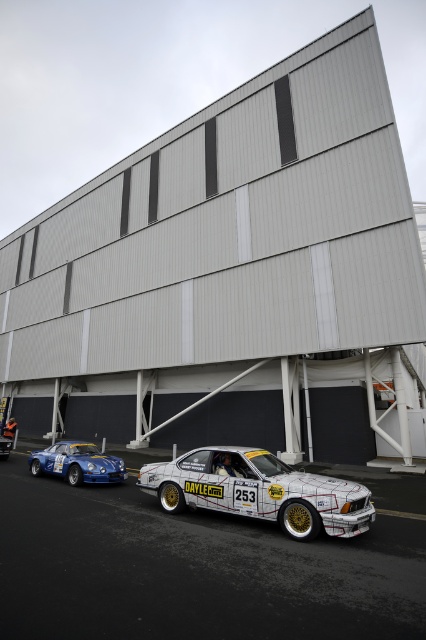
You are a photographer standing at the lower edge of the scene. You want to take a photo that includes both the white painted asphalt at lower center and the blue metallic car at lower left. Based on their positions, can you confirm if the asphalt is visible above the car in the frame?

The white painted asphalt at lower center is located above the blue metallic car at lower left, so yes, the asphalt will be visible above the car in the photo.

You are a photographer planning to take a wide shot of the gray metallic building at center and the white painted asphalt at lower center. Which object will occupy more space in your photo?

The gray metallic building at center is bigger than the white painted asphalt at lower center, so it will occupy more space in the photo.

You are a photographer planning to take a photo of the gray metallic building at center and the blue metallic car at lower left from a distance. Which object will appear larger in the photo?

The gray metallic building at center will appear larger in the photo because it is much taller than the blue metallic car at lower left.